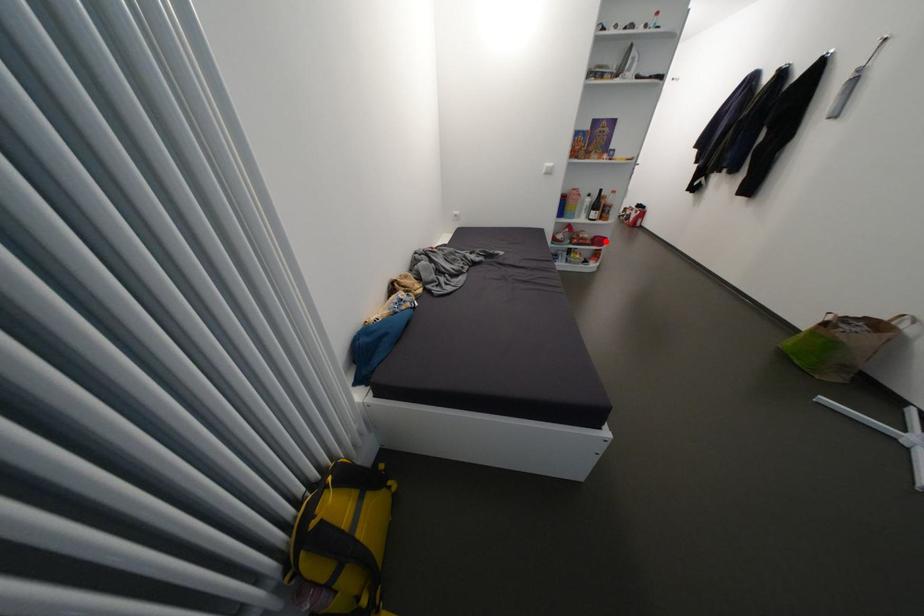
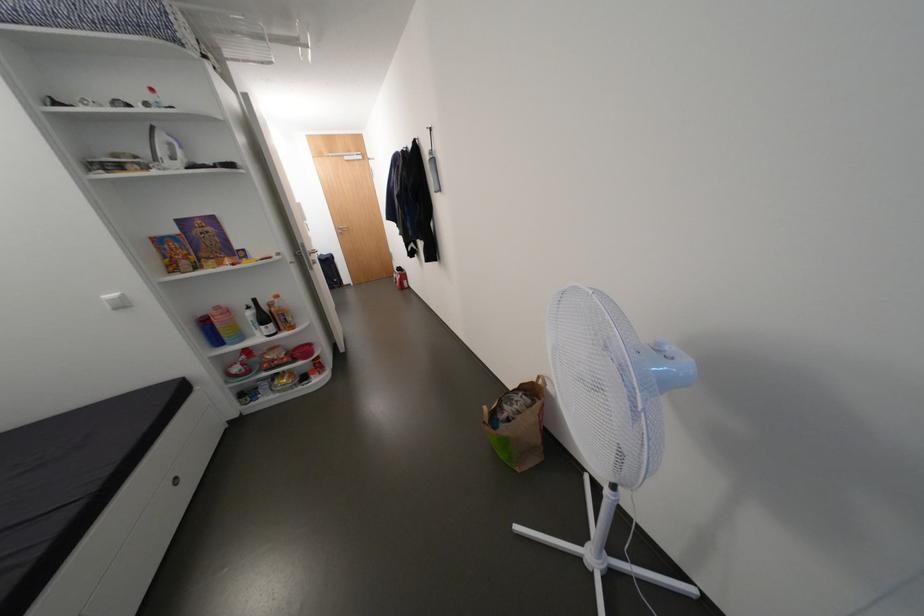
The point at the highlighted location is marked in the first image. Where is the corresponding point in the second image?

(310, 352)